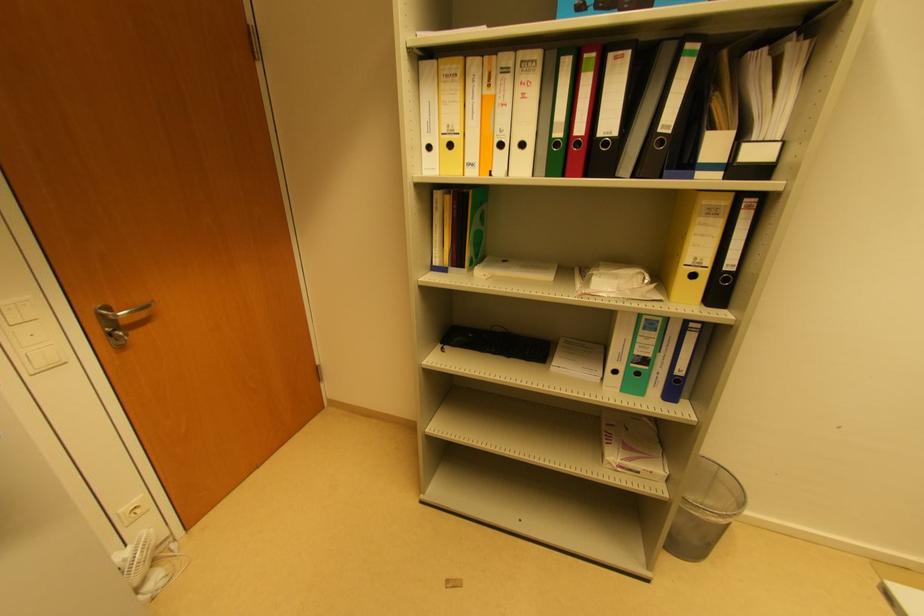
Find where to pull the metal door handle. Please return your answer as a coordinate pair (x, y).

(119, 310)